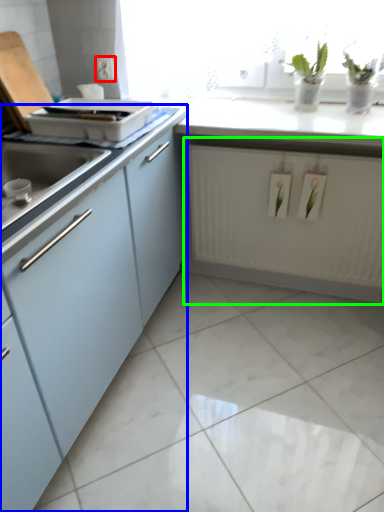
Question: Which is farther away from electric outlet (highlighted by a red box)? cabinetry (highlighted by a blue box) or radiator (highlighted by a green box)?

Choices:
 (A) cabinetry
 (B) radiator

Answer: (B)